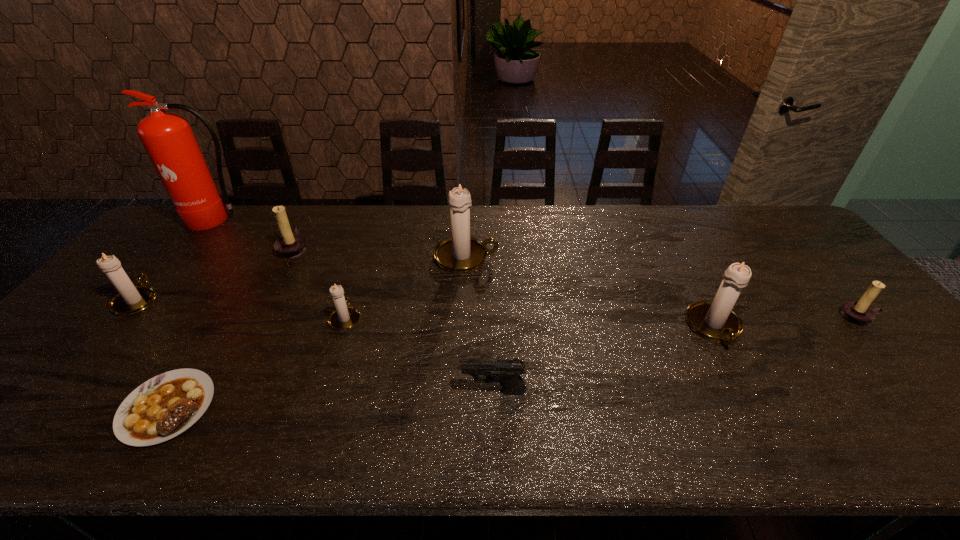
What are the coordinates of `vacant space situated 0.050m at the barrel of the second shortest object` in the screenshot? It's located at (440, 391).

This screenshot has height=540, width=960. Identify the location of free location located 0.170m on the right of the steak. (289, 407).

Where is `fire extinguisher at the far edge`? The image size is (960, 540). fire extinguisher at the far edge is located at coordinates (168, 139).

Image resolution: width=960 pixels, height=540 pixels. I want to click on object that is positioned at the near edge, so click(166, 405).

At what (x,y) coordinates should I click in order to perform the action: click on fire extinguisher positioned at the left edge. Please return your answer as a coordinate pair (x, y). This screenshot has width=960, height=540. Looking at the image, I should click on (168, 139).

This screenshot has width=960, height=540. Identify the location of candle holder that is at the left edge. (131, 299).

I want to click on object at the right edge, so click(859, 313).

Locate an element on the screen. object at the far left corner is located at coordinates (168, 139).

Identify the location of vacant space at the far edge of the desktop. The height and width of the screenshot is (540, 960). (352, 215).

In the image, there is a desktop. Identify the location of vacant area at the near edge. (271, 420).